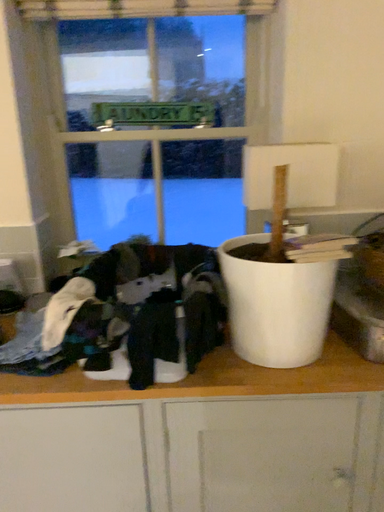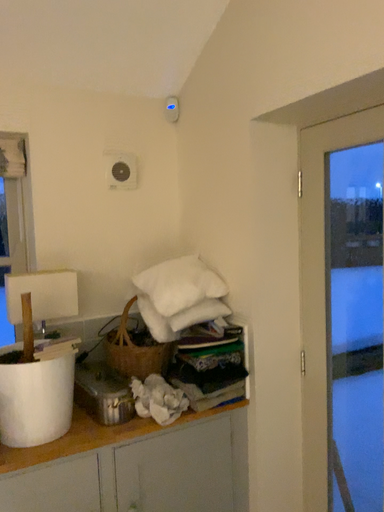
Question: Which way did the camera rotate in the video?

Choices:
 (A) rotated right
 (B) rotated left

Answer: (A)